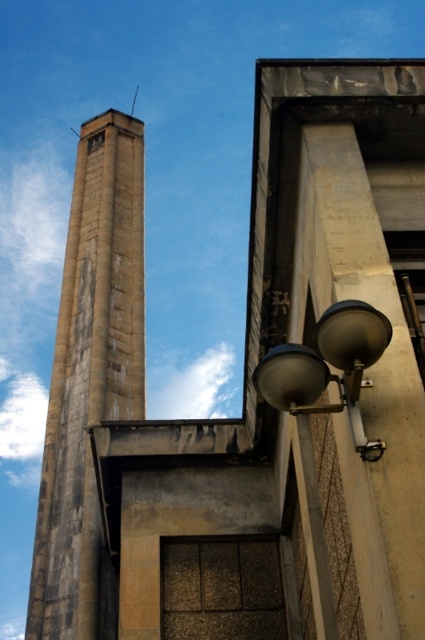
Question: Does concrete tower at left lie behind satin silver lamp at lower right?

Choices:
 (A) no
 (B) yes

Answer: (B)

Question: Is concrete tower at left positioned in front of satin silver lamp at lower right?

Choices:
 (A) no
 (B) yes

Answer: (A)

Question: Which point is farther to the camera?

Choices:
 (A) (342, 324)
 (B) (110, 150)

Answer: (B)

Question: Which object is farther from the camera taking this photo?

Choices:
 (A) satin silver lamp at lower right
 (B) concrete tower at left

Answer: (B)

Question: Does concrete tower at left lie in front of satin silver lamp at lower right?

Choices:
 (A) no
 (B) yes

Answer: (A)